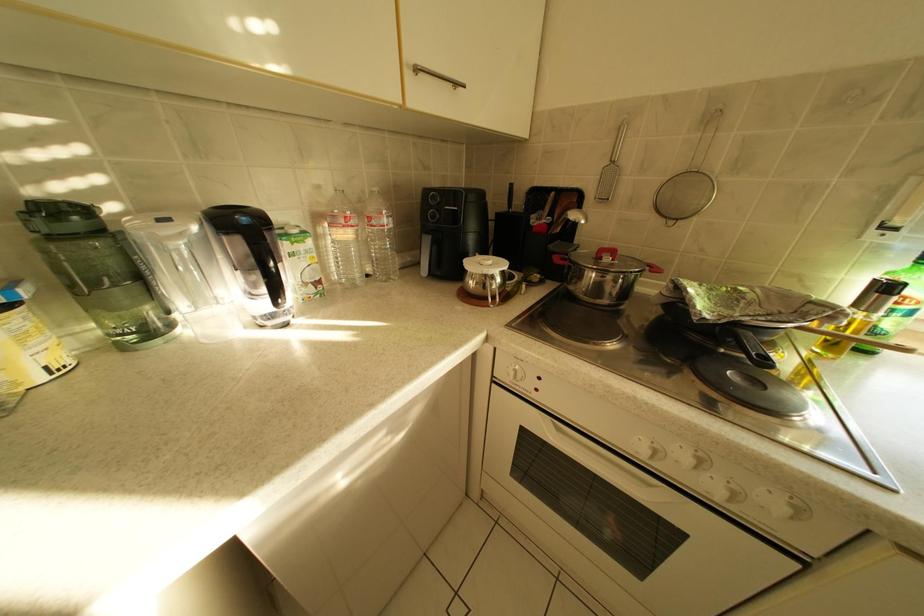
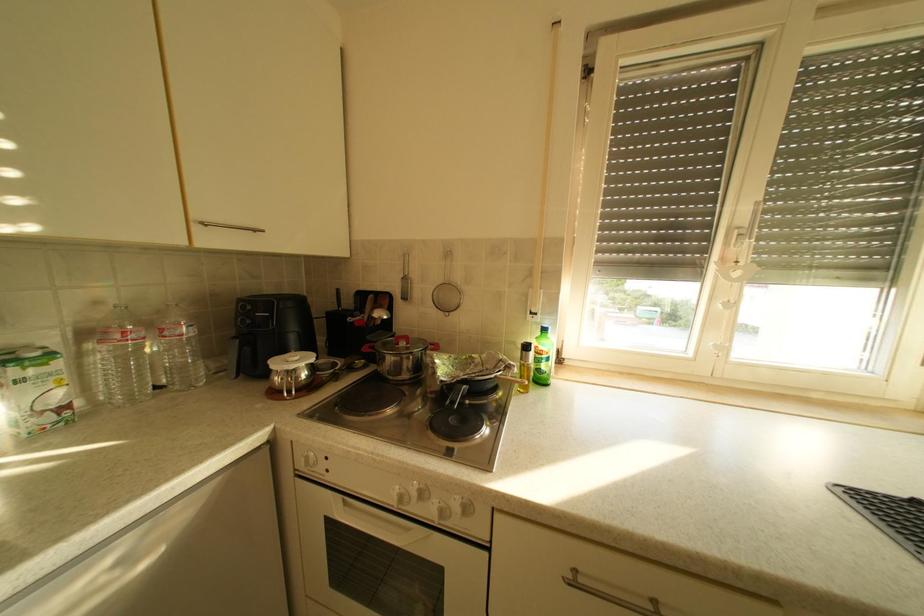
Based on the continuous images, in which direction is the camera rotating?

The camera's rotation is toward right-up.